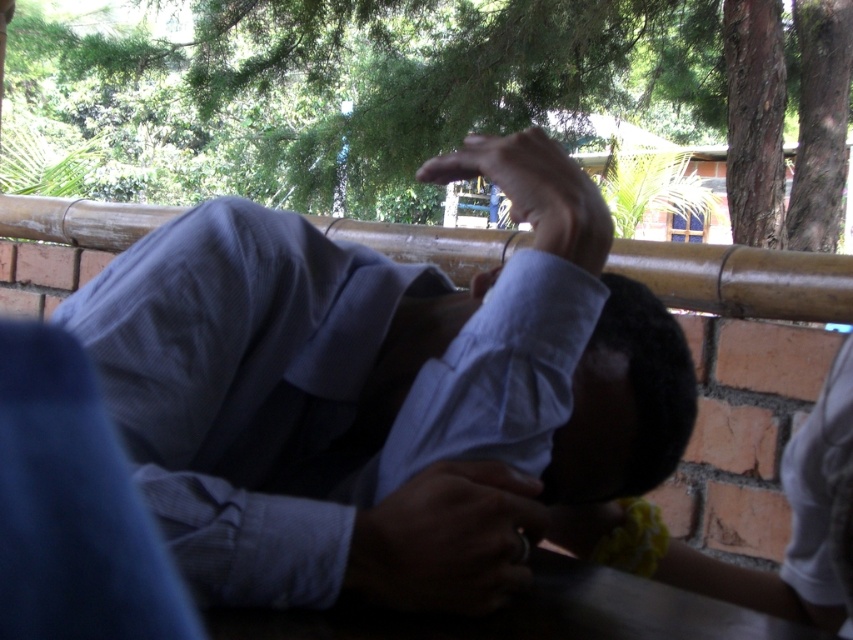
You are a photographer setting up a shot of the person in the scene. You need to ensure that the metallic ring at lower center and the matte blue shirt at upper center are both visible in the frame. Based on their positions, which object is closer to the bottom edge of the photo?

The metallic ring at lower center is closer to the bottom edge of the photo because it is shorter than the matte blue shirt at upper center.

You are a photographer trying to capture a closeup of the metallic ring at lower center without including the light blue shirt at center in the frame. Given their relative sizes, is this possible?

The light blue shirt at center is much taller than the metallic ring at lower center, so it might be challenging to frame the metallic ring at lower center without including the light blue shirt at center due to its larger size.